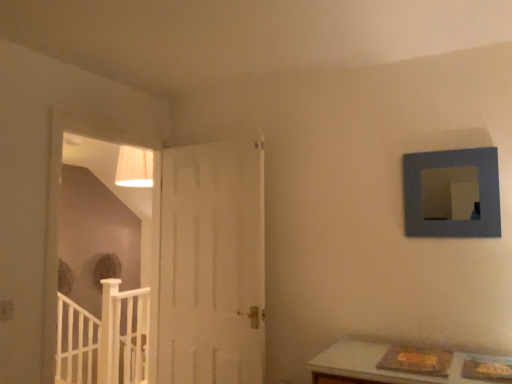
Question: Is white wooden rail at lower left located within white wood door at left?

Choices:
 (A) no
 (B) yes

Answer: (A)

Question: Can you confirm if white wood door at left is shorter than white wooden rail at lower left?

Choices:
 (A) no
 (B) yes

Answer: (A)

Question: Is white wood door at left not close to white wooden rail at lower left?

Choices:
 (A) yes
 (B) no

Answer: (A)

Question: Are white wood door at left and white wooden rail at lower left making contact?

Choices:
 (A) no
 (B) yes

Answer: (A)

Question: Is white wood door at left closer to camera compared to white wooden rail at lower left?

Choices:
 (A) yes
 (B) no

Answer: (A)

Question: Which is correct: blue matte picture frame at upper right is inside white wood door at left, or outside of it?

Choices:
 (A) inside
 (B) outside

Answer: (B)

Question: Considering the positions of point (416, 162) and point (47, 311), is point (416, 162) closer or farther from the camera than point (47, 311)?

Choices:
 (A) farther
 (B) closer

Answer: (A)

Question: Considering the positions of blue matte picture frame at upper right and white wood door at left in the image, is blue matte picture frame at upper right wider or thinner than white wood door at left?

Choices:
 (A) wide
 (B) thin

Answer: (B)

Question: From the image's perspective, is blue matte picture frame at upper right located above or below white wood door at left?

Choices:
 (A) below
 (B) above

Answer: (B)

Question: Is white wood door at left situated inside white wooden rail at lower left or outside?

Choices:
 (A) inside
 (B) outside

Answer: (B)

Question: From a real-world perspective, is white wood door at left positioned above or below white wooden rail at lower left?

Choices:
 (A) above
 (B) below

Answer: (A)

Question: Based on their positions, is white wood door at left located to the left or right of white wooden rail at lower left?

Choices:
 (A) right
 (B) left

Answer: (A)

Question: Is white wood door at left wider or thinner than white wooden rail at lower left?

Choices:
 (A) thin
 (B) wide

Answer: (A)

Question: Is point (93, 137) closer or farther from the camera than point (482, 216)?

Choices:
 (A) closer
 (B) farther

Answer: (B)

Question: Is white wood door at left in front of or behind blue matte picture frame at upper right in the image?

Choices:
 (A) front
 (B) behind

Answer: (B)